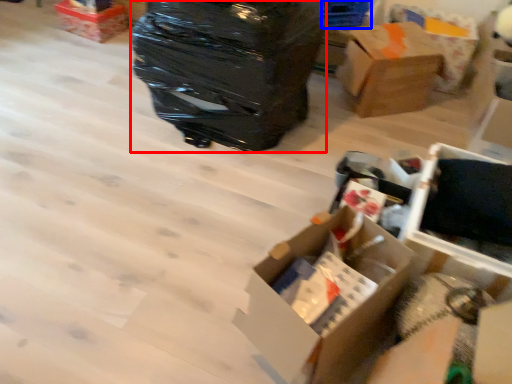
Question: Which object appears closest to the camera in this image, garbage (highlighted by a red box) or storage box (highlighted by a blue box)?

Choices:
 (A) garbage
 (B) storage box

Answer: (A)